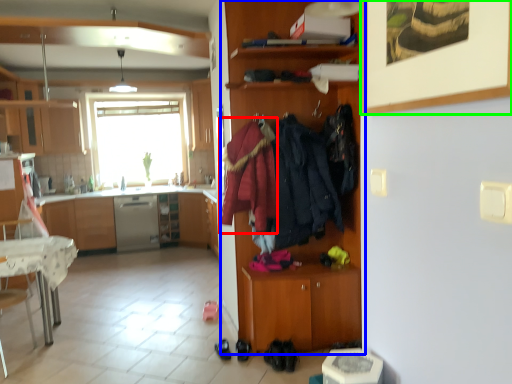
Question: Which is farther away from clothing (highlighted by a red box)? cabinetry (highlighted by a blue box) or picture frame (highlighted by a green box)?

Choices:
 (A) cabinetry
 (B) picture frame

Answer: (B)